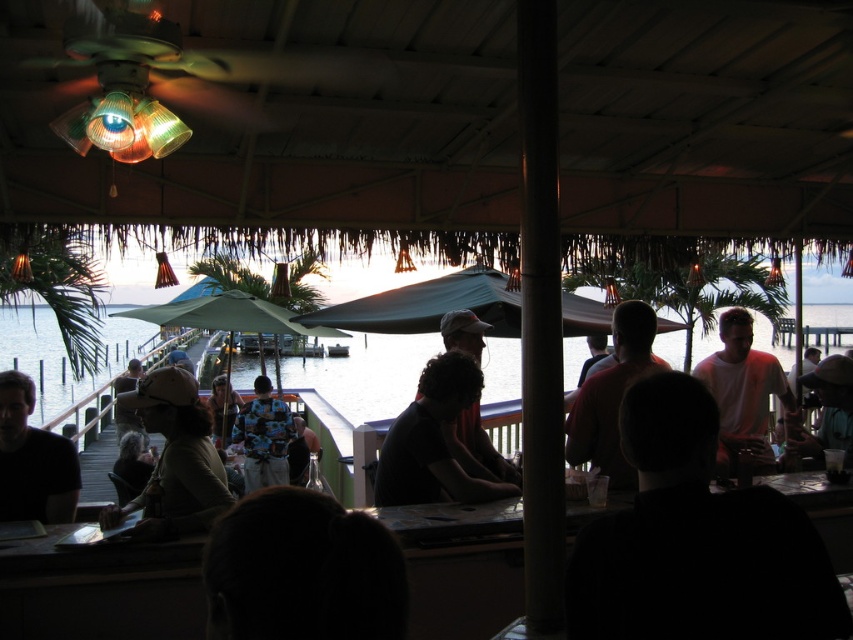
You are a bartender at the bar counter. You need to deliver a drink to the person wearing the white matte shirt at center and another drink to the person wearing the dark brown leather jacket at center. If your tray can only hold one drink at a time, which customer should you serve first to minimize walking distance?

You should serve both customers simultaneously since they are 1.78 meters apart, but since the tray can only hold one drink at a time, there is no difference in walking distance whether you start with the white matte shirt at center or the dark brown leather jacket at center. The total distance remains the same either way.

You are a photographer standing at the point marked as point (x=302, y=572). You want to take a picture of the dark brown hair at lower center. Is the point you are standing at the correct location to capture the dark brown hair at lower center in your photo?

Yes, the point (x=302, y=572) is on the dark brown hair at lower center, so standing there would allow you to capture it in the photo.

You are a bartender at the bar counter. You need to hand a drink to both the white matte shirt at center and the dark brown leather jacket at center. Which customer should you serve first if you want to reach the person who is closer to the counter?

The white matte shirt at center has a smaller size compared to dark brown leather jacket at center, so the bartender should serve the white matte shirt at center first as they are closer to the counter.